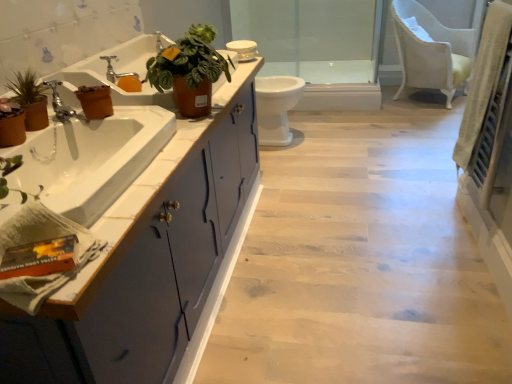
Question: Is brown terracotta pot at left, which is the second flowerpot in left-to-right order, at the right side of matte blue cabinet at left?

Choices:
 (A) yes
 (B) no

Answer: (B)

Question: Can you confirm if brown terracotta pot at left, which ranks as the 2th flowerpot in front-to-back order, is thinner than matte blue cabinet at left?

Choices:
 (A) no
 (B) yes

Answer: (B)

Question: Is brown terracotta pot at left, which is the 1th flowerpot from right to left, positioned before matte blue cabinet at left?

Choices:
 (A) yes
 (B) no

Answer: (B)

Question: From the image's perspective, would you say brown terracotta pot at left, which is the second flowerpot in bottom-to-top order, is positioned over matte blue cabinet at left?

Choices:
 (A) yes
 (B) no

Answer: (A)

Question: Considering the relative sizes of brown terracotta pot at left, which is the second flowerpot in bottom-to-top order, and matte blue cabinet at left in the image provided, is brown terracotta pot at left, which is the second flowerpot in bottom-to-top order, smaller than matte blue cabinet at left?

Choices:
 (A) yes
 (B) no

Answer: (A)

Question: Considering the positions of point (24, 107) and point (132, 375), is point (24, 107) closer or farther from the camera than point (132, 375)?

Choices:
 (A) closer
 (B) farther

Answer: (B)

Question: From a real-world perspective, is matte brown pot at left, arranged as the 2th houseplant when viewed from the right, physically located above or below matte blue cabinet at left?

Choices:
 (A) below
 (B) above

Answer: (B)

Question: From the image's perspective, relative to matte blue cabinet at left, is matte brown pot at left, arranged as the 2th houseplant when viewed from the right, above or below?

Choices:
 (A) below
 (B) above

Answer: (B)

Question: Is matte brown pot at left, which is counted as the first houseplant, starting from the left, wider or thinner than matte blue cabinet at left?

Choices:
 (A) thin
 (B) wide

Answer: (A)

Question: Considering the positions of point (35, 102) and point (106, 72), is point (35, 102) closer or farther from the camera than point (106, 72)?

Choices:
 (A) farther
 (B) closer

Answer: (B)

Question: Considering their positions, is matte brown pot at left, which is counted as the first houseplant, starting from the left, located in front of or behind silver metallic faucet at upper left, positioned as the second tap in bottom-to-top order?

Choices:
 (A) front
 (B) behind

Answer: (A)

Question: From a real-world perspective, is matte brown pot at left, arranged as the 2th houseplant when viewed from the right, above or below silver metallic faucet at upper left, positioned as the second tap in bottom-to-top order?

Choices:
 (A) above
 (B) below

Answer: (A)

Question: From the image's perspective, is matte brown pot at left, arranged as the 2th houseplant when viewed from the right, positioned above or below silver metallic faucet at upper left, which appears as the 1th tap when viewed from the top?

Choices:
 (A) below
 (B) above

Answer: (A)

Question: Visually, is matte brown flowerpot at left, the first flowerpot viewed from the left, positioned to the left or to the right of leather-like terracotta pot at upper center, which appears as the 1th houseplant when viewed from the right?

Choices:
 (A) right
 (B) left

Answer: (B)

Question: From a real-world perspective, is matte brown flowerpot at left, the first flowerpot viewed from the left, physically located above or below leather-like terracotta pot at upper center, which appears as the 1th houseplant when viewed from the right?

Choices:
 (A) above
 (B) below

Answer: (B)